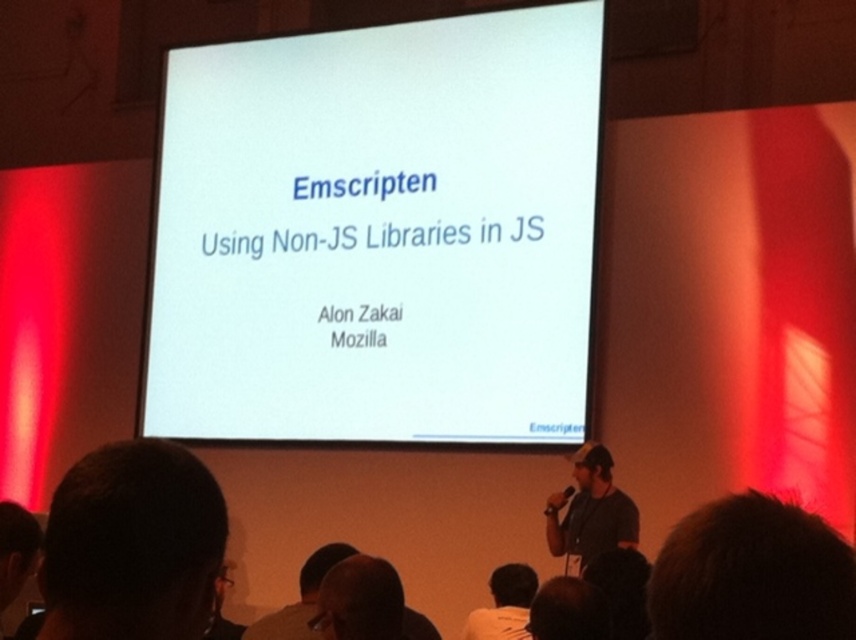
Question: Among these points, which one is farthest from the camera?

Choices:
 (A) (622, 544)
 (B) (848, 588)

Answer: (A)

Question: Is bald head at lower center in front of brown leather jacket at lower center?

Choices:
 (A) yes
 (B) no

Answer: (A)

Question: Among these points, which one is nearest to the camera?

Choices:
 (A) (274, 624)
 (B) (207, 552)

Answer: (B)

Question: Is gray fabric shirt at lower right behind brown hair at lower left?

Choices:
 (A) no
 (B) yes

Answer: (B)

Question: Where is white paper at center located in relation to bald head at lower center in the image?

Choices:
 (A) right
 (B) left

Answer: (B)

Question: Which of the following is the closest to the observer?

Choices:
 (A) dark hair at lower left
 (B) brown hair at lower right
 (C) white paper at center

Answer: (B)